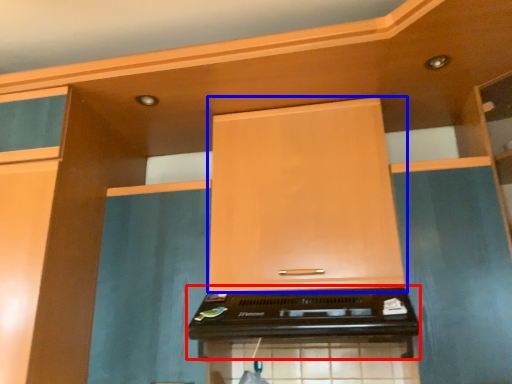
Question: Among these objects, which one is nearest to the camera, appliance (highlighted by a red box) or cabinetry (highlighted by a blue box)?

Choices:
 (A) appliance
 (B) cabinetry

Answer: (A)